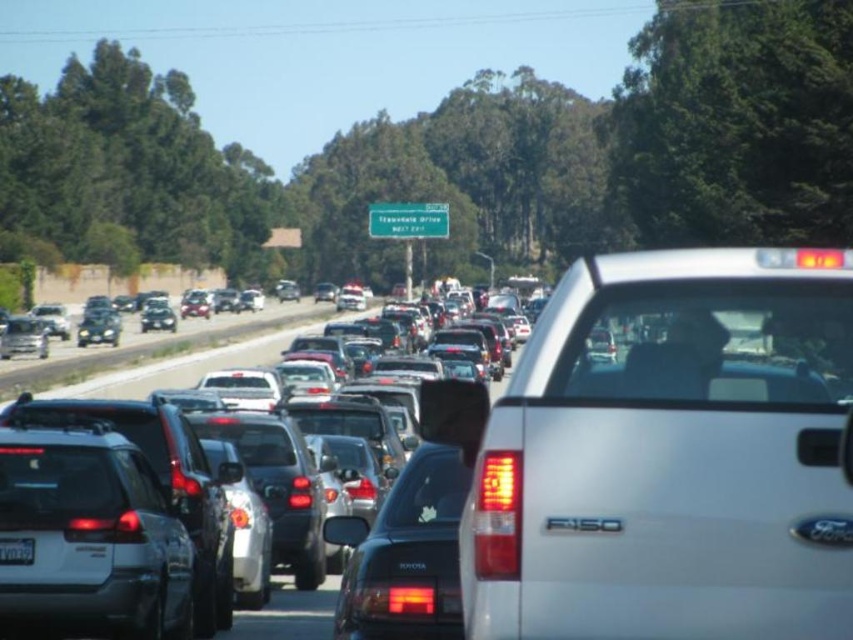
Question: Can you confirm if white matte truck at center is positioned above metallic silver cars at center?

Choices:
 (A) yes
 (B) no

Answer: (A)

Question: Does white matte truck at center appear over matte black suv at center?

Choices:
 (A) no
 (B) yes

Answer: (B)

Question: Which of the following is the closest to the observer?

Choices:
 (A) matte black suv at center
 (B) metallic silver cars at center
 (C) black plastic license plate at center
 (D) white matte truck at center

Answer: (D)

Question: Which of the following is the farthest from the observer?

Choices:
 (A) matte black suv at center
 (B) metallic silver cars at center
 (C) white matte truck at center
 (D) black plastic license plate at center

Answer: (B)

Question: Which point is closer to the camera?

Choices:
 (A) (207, 330)
 (B) (15, 538)
 (C) (160, 365)

Answer: (B)

Question: From the image, what is the correct spatial relationship of matte black suv at center in relation to black plastic license plate at center?

Choices:
 (A) above
 (B) below

Answer: (A)